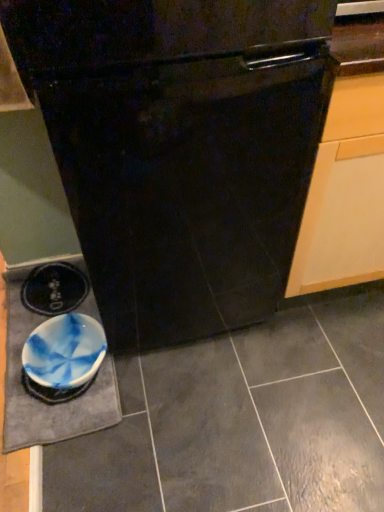
Question: Is black glossy oven at center thinner than blue marbled slate at lower left?

Choices:
 (A) yes
 (B) no

Answer: (B)

Question: From a real-world perspective, is black glossy oven at center located higher than blue marbled slate at lower left?

Choices:
 (A) no
 (B) yes

Answer: (B)

Question: From a real-world perspective, is black glossy oven at center below blue marbled slate at lower left?

Choices:
 (A) yes
 (B) no

Answer: (B)

Question: Could you tell me if black glossy oven at center is facing blue marbled slate at lower left?

Choices:
 (A) no
 (B) yes

Answer: (A)

Question: Is blue marbled slate at lower left surrounded by black glossy oven at center?

Choices:
 (A) no
 (B) yes

Answer: (A)

Question: Can you confirm if black glossy oven at center is shorter than blue marbled slate at lower left?

Choices:
 (A) yes
 (B) no

Answer: (B)

Question: Is blue marbled slate at lower left facing towards blue marbled bowl at lower left?

Choices:
 (A) no
 (B) yes

Answer: (B)

Question: Is blue marbled slate at lower left far away from blue marbled bowl at lower left?

Choices:
 (A) yes
 (B) no

Answer: (B)

Question: Does blue marbled slate at lower left have a greater width compared to blue marbled bowl at lower left?

Choices:
 (A) yes
 (B) no

Answer: (A)

Question: Is blue marbled slate at lower left thinner than blue marbled bowl at lower left?

Choices:
 (A) yes
 (B) no

Answer: (B)

Question: Could blue marbled bowl at lower left be considered to be inside blue marbled slate at lower left?

Choices:
 (A) yes
 (B) no

Answer: (A)

Question: Does blue marbled slate at lower left have a greater height compared to blue marbled bowl at lower left?

Choices:
 (A) yes
 (B) no

Answer: (B)

Question: Considering the relative sizes of black glossy oven at center and blue marbled bowl at lower left in the image provided, is black glossy oven at center smaller than blue marbled bowl at lower left?

Choices:
 (A) yes
 (B) no

Answer: (B)